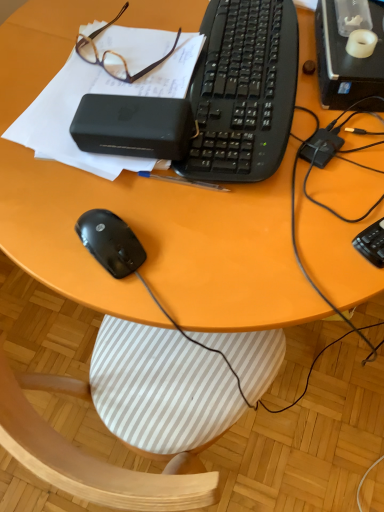
The height and width of the screenshot is (512, 384). In order to click on free space above black plastic keyboard at center, acting as the 1th computer keyboard starting from the left (from a real-world perspective) in this screenshot , I will do `click(247, 63)`.